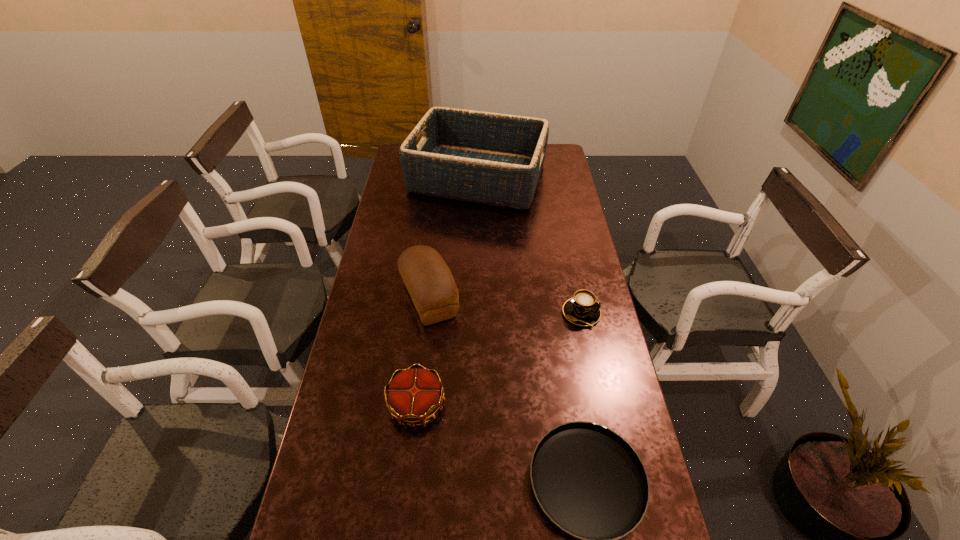
Where is `blank space that satisfies the following two spatial constraints: 1. on the back side of the crown; 2. on the left side of the fourth shortest object`? This screenshot has height=540, width=960. blank space that satisfies the following two spatial constraints: 1. on the back side of the crown; 2. on the left side of the fourth shortest object is located at coordinates (428, 299).